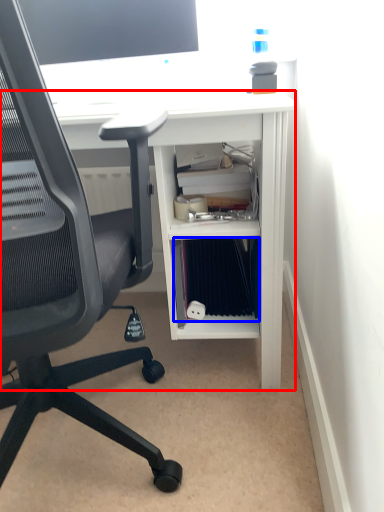
Question: Which object appears farthest to the camera in this image, desk (highlighted by a red box) or binder (highlighted by a blue box)?

Choices:
 (A) desk
 (B) binder

Answer: (B)